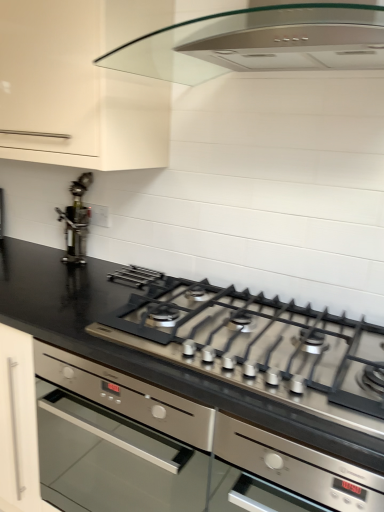
Question: Is matte white cabinet at upper left wider than satin silver gas stove at center?

Choices:
 (A) yes
 (B) no

Answer: (B)

Question: Can you confirm if matte white cabinet at upper left is bigger than satin silver gas stove at center?

Choices:
 (A) yes
 (B) no

Answer: (A)

Question: Is matte white cabinet at upper left at the left side of satin silver gas stove at center?

Choices:
 (A) yes
 (B) no

Answer: (A)

Question: Does matte white cabinet at upper left turn towards satin silver gas stove at center?

Choices:
 (A) no
 (B) yes

Answer: (A)

Question: Is matte white cabinet at upper left turned away from satin silver gas stove at center?

Choices:
 (A) yes
 (B) no

Answer: (B)

Question: Is satin silver gas stove at center inside matte white cabinet at upper left?

Choices:
 (A) no
 (B) yes

Answer: (A)

Question: Does stainless steel at left have a lesser width compared to black glossy countertop at center?

Choices:
 (A) no
 (B) yes

Answer: (B)

Question: Can you confirm if stainless steel at left is smaller than black glossy countertop at center?

Choices:
 (A) no
 (B) yes

Answer: (B)

Question: Considering the relative sizes of stainless steel at left and black glossy countertop at center in the image provided, is stainless steel at left bigger than black glossy countertop at center?

Choices:
 (A) no
 (B) yes

Answer: (A)

Question: Considering the relative sizes of stainless steel at left and black glossy countertop at center in the image provided, is stainless steel at left taller than black glossy countertop at center?

Choices:
 (A) yes
 (B) no

Answer: (B)

Question: Is stainless steel at left not inside black glossy countertop at center?

Choices:
 (A) yes
 (B) no

Answer: (A)

Question: From the image's perspective, would you say stainless steel at left is shown under black glossy countertop at center?

Choices:
 (A) no
 (B) yes

Answer: (A)

Question: Is black glossy countertop at center with matte white cabinet at upper left?

Choices:
 (A) no
 (B) yes

Answer: (A)